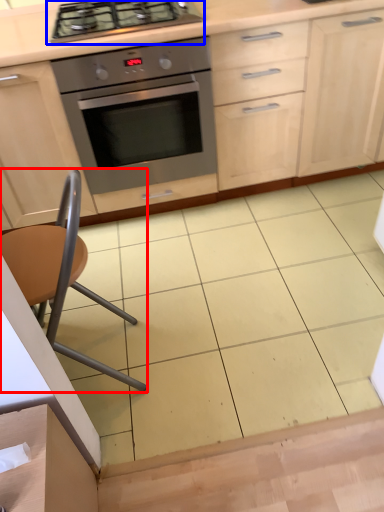
Question: Which object appears closest to the camera in this image, chair (highlighted by a red box) or gas stove (highlighted by a blue box)?

Choices:
 (A) chair
 (B) gas stove

Answer: (A)